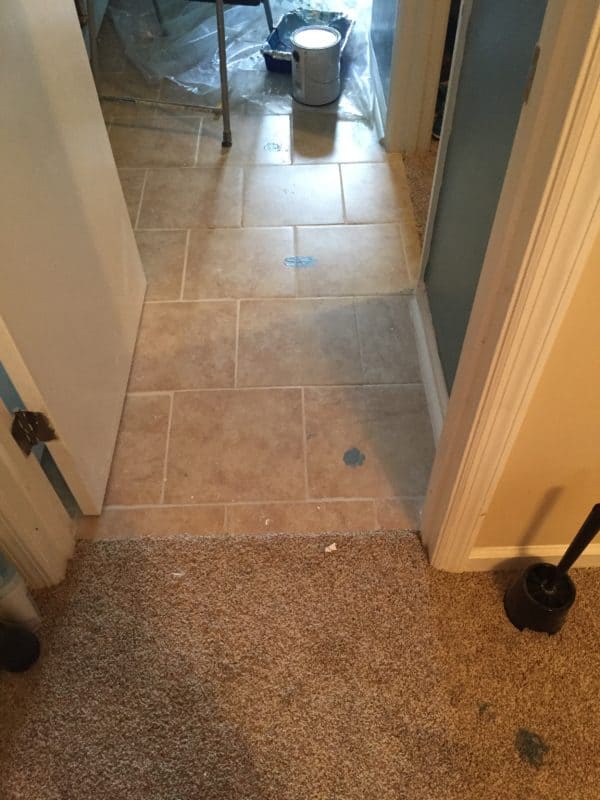
I want to click on light brown tile, so click(298, 349).